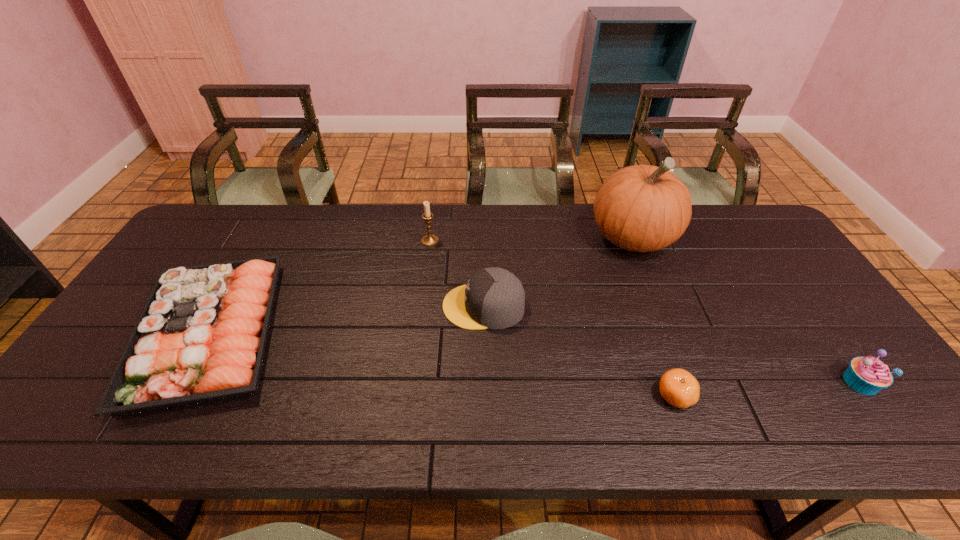
Where is `vacant position in the image that satisfies the following two spatial constraints: 1. on the front-facing side of the cap; 2. on the right side of the clementine`? This screenshot has width=960, height=540. vacant position in the image that satisfies the following two spatial constraints: 1. on the front-facing side of the cap; 2. on the right side of the clementine is located at coordinates (485, 396).

Identify the location of free space in the image that satisfies the following two spatial constraints: 1. on the back side of the clementine; 2. on the front-facing side of the cap. Image resolution: width=960 pixels, height=540 pixels. (643, 306).

You are a GUI agent. You are given a task and a screenshot of the screen. Output one action in this format:
    pyautogui.click(x=<x>, y=<y>)
    Task: Click on the vacant region that satisfies the following two spatial constraints: 1. on the stem of the tallest object; 2. on the front-facing side of the cap
    This screenshot has width=960, height=540.
    Given the screenshot: What is the action you would take?
    pyautogui.click(x=660, y=306)

I want to click on vacant area that satisfies the following two spatial constraints: 1. on the front-facing side of the cap; 2. on the back side of the rightmost object, so click(484, 382).